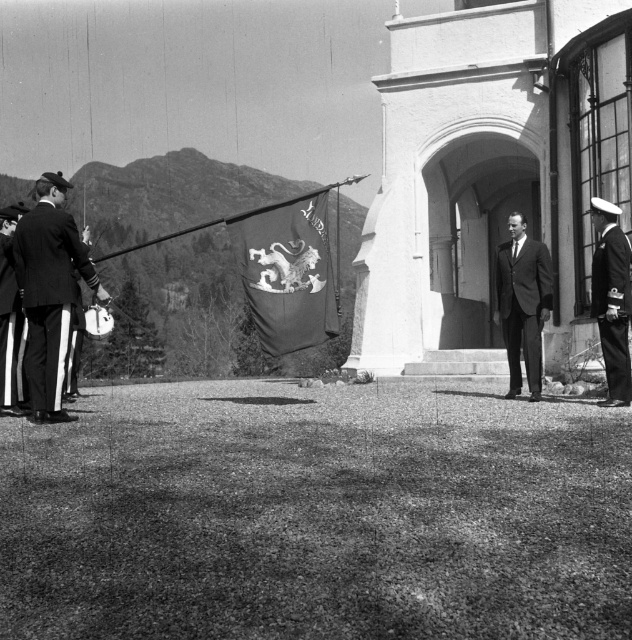
Question: Estimate the real-world distances between objects in this image. Which object is farther from the uniformed man at left?

Choices:
 (A) shiny black uniform at right
 (B) silky fabric flag at center
 (C) black wool suit at left
 (D) dark gray suit at center

Answer: (A)

Question: Is uniformed man at left to the right of shiny black uniform at right from the viewer's perspective?

Choices:
 (A) no
 (B) yes

Answer: (A)

Question: Is the position of uniformed man at left less distant than that of black wool suit at left?

Choices:
 (A) no
 (B) yes

Answer: (B)

Question: Can you confirm if uniformed man at left is positioned below shiny black uniform at right?

Choices:
 (A) no
 (B) yes

Answer: (A)

Question: Which point appears closest to the camera in this image?

Choices:
 (A) (44, 308)
 (B) (535, 364)

Answer: (A)

Question: Which point is farther to the camera?

Choices:
 (A) (8, 305)
 (B) (609, 221)
 (C) (497, 285)

Answer: (C)